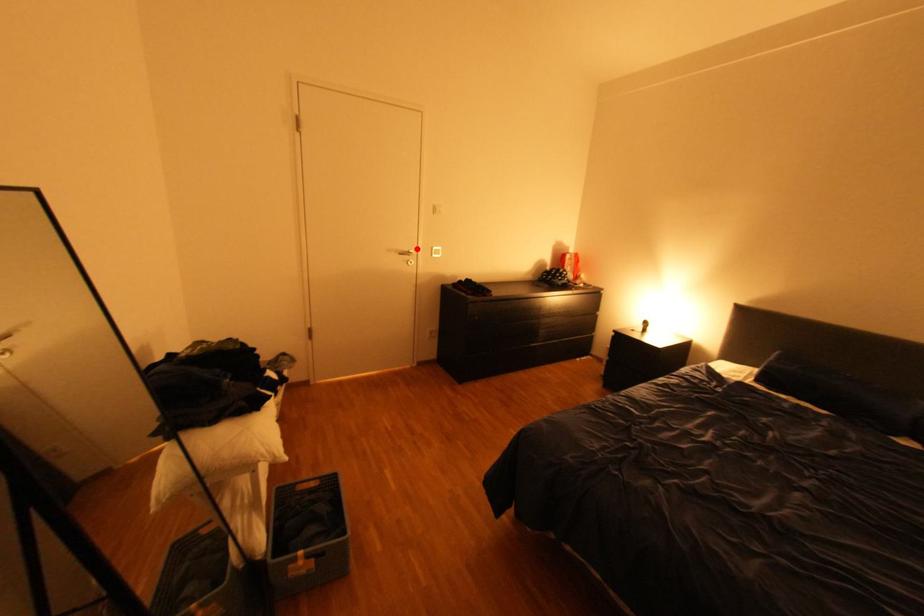
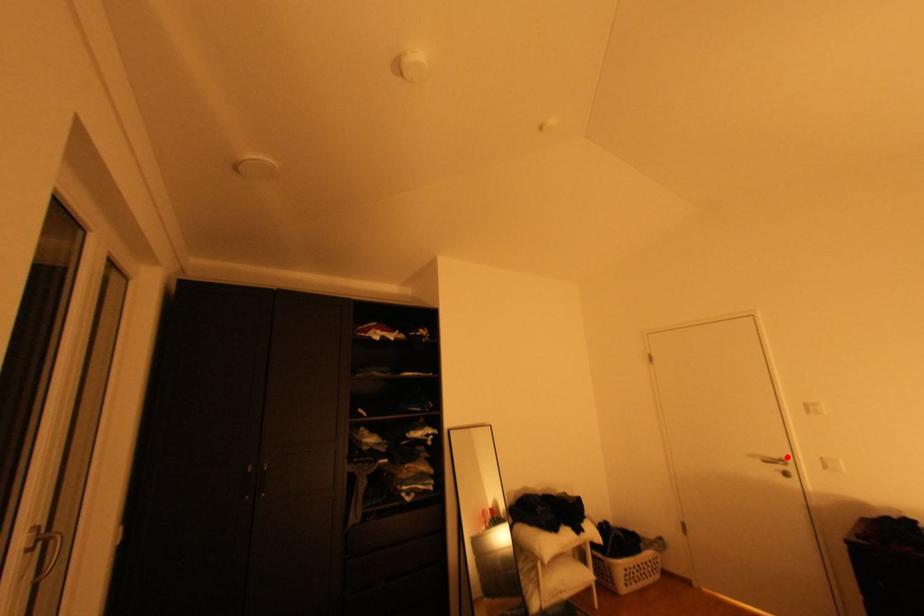
I am providing you with two images of the same scene from different viewpoints. A red point is marked on the first image and another point is marked on the second image. Are the points marked in image1 and image2 representing the same 3D position?

Yes